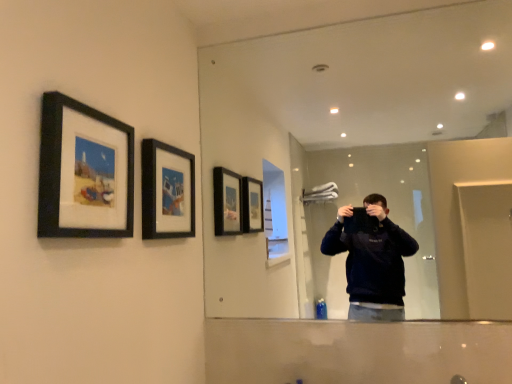
Question: Is black matte picture frame at upper left, which is counted as the 1th picture frame, starting from the front, inside the boundaries of clear glass mirror at upper center, or outside?

Choices:
 (A) outside
 (B) inside

Answer: (A)

Question: From the image's perspective, is black matte picture frame at upper left, which is the first picture frame from left to right, positioned above or below clear glass mirror at upper center?

Choices:
 (A) above
 (B) below

Answer: (B)

Question: Estimate the real-world distances between objects in this image. Which object is closer to the clear glass mirror at upper center?

Choices:
 (A) black matte picture frame at upper center, which ranks as the 2th picture frame in left-to-right order
 (B) black matte picture frame at upper left, which is counted as the 1th picture frame, starting from the front

Answer: (A)

Question: Which object is positioned closest to the black matte picture frame at upper left, which appears as the 2th picture frame when viewed from the back?

Choices:
 (A) black matte picture frame at upper center, marked as the first picture frame in a right-to-left arrangement
 (B) clear glass mirror at upper center

Answer: (A)